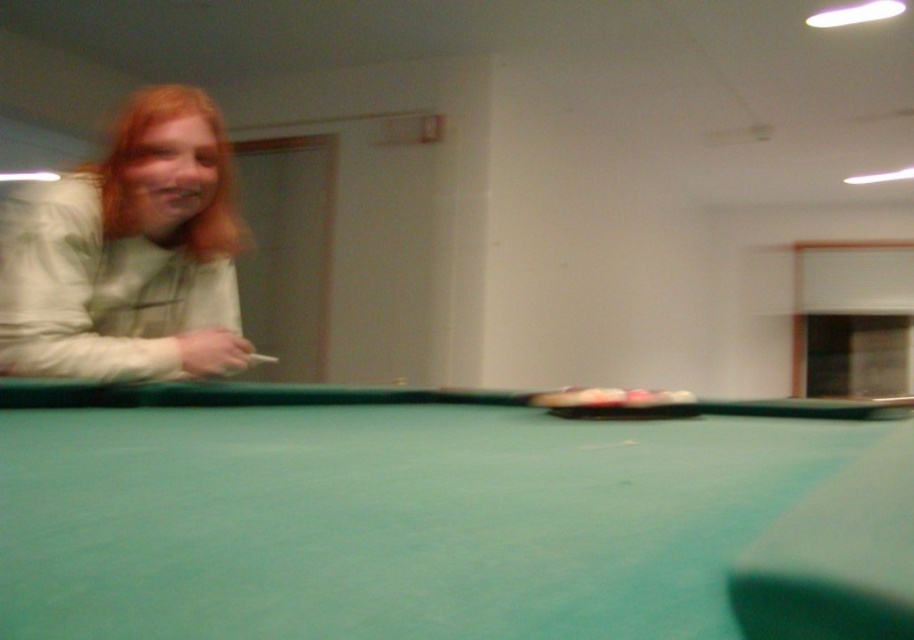
You are standing in the room and want to move from point (x=121, y=595) to point (x=118, y=240). Which direction should you face to walk towards the second point?

Point (x=121, y=595) is closer to the viewer than point (x=118, y=240), so you should face away from the pool table to walk towards the second point.

You are standing in the room and want to place a decorative plant exactly at the center of the room. The green felt billiard table at center is located at coordinate point 0.809, 0.487. Is the table positioned to the left or right of the room center?

The green felt billiard table at center is located at coordinate point (x=444, y=516). Since the x coordinate is 0.809, which is greater than 0.5, the table is positioned to the right of the room center.